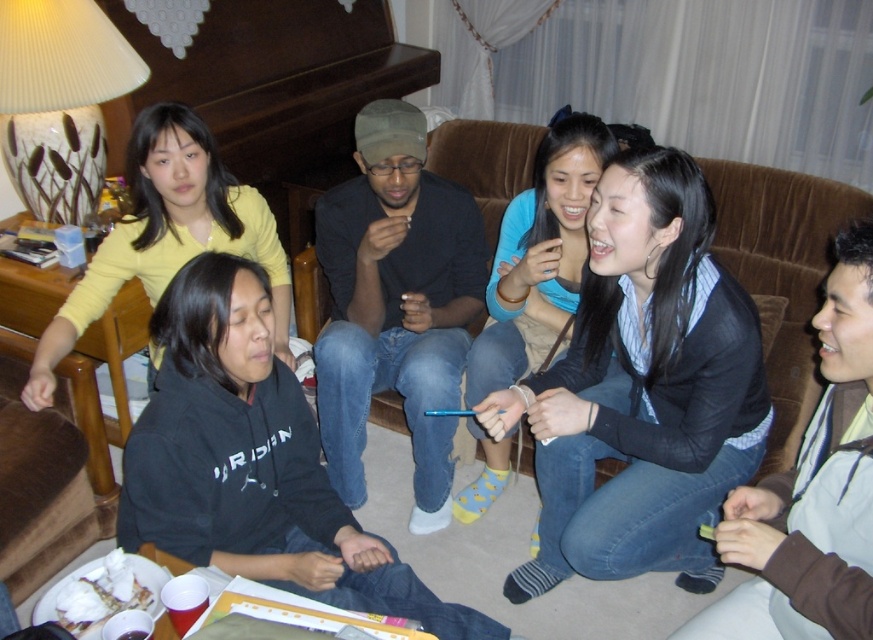
Which is in front, point (186, 211) or point (552, 241)?

Positioned in front is point (552, 241).

Describe the element at coordinates (167, 234) in the screenshot. Image resolution: width=873 pixels, height=640 pixels. I see `yellow matte shirt at upper left` at that location.

Who is more forward, (198, 136) or (468, 492)?

Point (198, 136)

Where is `yellow matte shirt at upper left`? This screenshot has height=640, width=873. yellow matte shirt at upper left is located at coordinates pyautogui.click(x=167, y=234).

At what (x,y) coordinates should I click in order to perform the action: click on matte black jacket at center. Please return your answer as a coordinate pair (x, y). Looking at the image, I should click on (643, 388).

Does point (605, 257) come closer to viewer compared to point (530, 276)?

Yes, point (605, 257) is in front of point (530, 276).

Where is `matte black jacket at center`? The width and height of the screenshot is (873, 640). matte black jacket at center is located at coordinates (643, 388).

The width and height of the screenshot is (873, 640). What do you see at coordinates (643, 388) in the screenshot? I see `matte black jacket at center` at bounding box center [643, 388].

Does matte black jacket at center lie behind yellow matte shirt at upper left?

No.

Is point (652, 205) in front of point (143, 259)?

Yes, point (652, 205) is closer to viewer.

I want to click on matte black jacket at center, so coord(643,388).